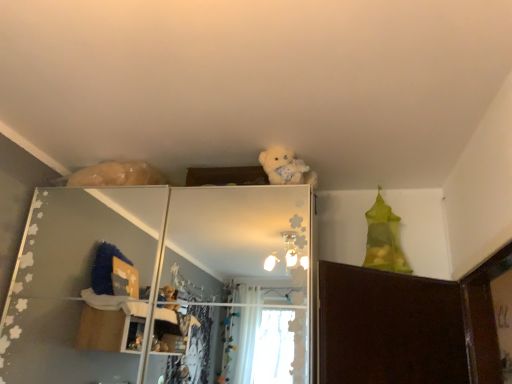
Locate an element on the screen. fluffy white teddy bear at upper center is located at coordinates click(286, 167).

Describe the element at coordinates (286, 167) in the screenshot. I see `fluffy white teddy bear at upper center` at that location.

In the scene shown: Measure the distance between white glossy shelf at upper center and camera.

6.44 feet.

What do you see at coordinates (162, 286) in the screenshot? The height and width of the screenshot is (384, 512). I see `white glossy shelf at upper center` at bounding box center [162, 286].

Find the location of a particular element. The width and height of the screenshot is (512, 384). white glossy shelf at upper center is located at coordinates (162, 286).

You are a GUI agent. You are given a task and a screenshot of the screen. Output one action in this format:
    pyautogui.click(x=<x>, y=<y>)
    Task: Click on the fluffy white teddy bear at upper center
    This screenshot has height=384, width=512.
    Given the screenshot: What is the action you would take?
    pyautogui.click(x=286, y=167)

Between white glossy shelf at upper center and fluffy white teddy bear at upper center, which one appears on the right side from the viewer's perspective?

fluffy white teddy bear at upper center.

Which object is further away from the camera taking this photo, white glossy shelf at upper center or fluffy white teddy bear at upper center?

fluffy white teddy bear at upper center.

Considering the points (219, 353) and (306, 171), which point is in front, point (219, 353) or point (306, 171)?

The point (219, 353) is closer.

From the image's perspective, is white glossy shelf at upper center on fluffy white teddy bear at upper center?

Actually, white glossy shelf at upper center appears below fluffy white teddy bear at upper center in the image.

From a real-world perspective, who is located lower, white glossy shelf at upper center or fluffy white teddy bear at upper center?

From a 3D spatial view, white glossy shelf at upper center is below.

Is white glossy shelf at upper center thinner than fluffy white teddy bear at upper center?

No, white glossy shelf at upper center is not thinner than fluffy white teddy bear at upper center.

Considering the sizes of objects white glossy shelf at upper center and fluffy white teddy bear at upper center in the image provided, who is shorter, white glossy shelf at upper center or fluffy white teddy bear at upper center?

fluffy white teddy bear at upper center is shorter.

Who is smaller, white glossy shelf at upper center or fluffy white teddy bear at upper center?

Smaller between the two is fluffy white teddy bear at upper center.

Which is correct: white glossy shelf at upper center is inside fluffy white teddy bear at upper center, or outside of it?

white glossy shelf at upper center is located beyond the bounds of fluffy white teddy bear at upper center.

Is white glossy shelf at upper center beside fluffy white teddy bear at upper center?

No, white glossy shelf at upper center is not beside fluffy white teddy bear at upper center.

Is white glossy shelf at upper center looking in the opposite direction of fluffy white teddy bear at upper center?

No, white glossy shelf at upper center is not facing the opposite direction of fluffy white teddy bear at upper center.

Locate an element on the screen. teddy lying behind the white glossy shelf at upper center is located at coordinates (286, 167).

Based on the photo, considering the relative positions of fluffy white teddy bear at upper center and white glossy shelf at upper center in the image provided, is fluffy white teddy bear at upper center to the left or to the right of white glossy shelf at upper center?

In the image, fluffy white teddy bear at upper center appears on the right side of white glossy shelf at upper center.

In the image, is fluffy white teddy bear at upper center positioned in front of or behind white glossy shelf at upper center?

fluffy white teddy bear at upper center is behind white glossy shelf at upper center.

Is point (292, 181) closer to camera compared to point (98, 194)?

That is True.

From the image's perspective, relative to white glossy shelf at upper center, is fluffy white teddy bear at upper center above or below?

Clearly, from the image's perspective, fluffy white teddy bear at upper center is above white glossy shelf at upper center.

From a real-world perspective, is fluffy white teddy bear at upper center located beneath white glossy shelf at upper center?

Incorrect, from a real-world perspective, fluffy white teddy bear at upper center is higher than white glossy shelf at upper center.

Does fluffy white teddy bear at upper center have a lesser width compared to white glossy shelf at upper center?

Correct, the width of fluffy white teddy bear at upper center is less than that of white glossy shelf at upper center.

Which of these two, fluffy white teddy bear at upper center or white glossy shelf at upper center, stands taller?

white glossy shelf at upper center.

Is fluffy white teddy bear at upper center smaller than white glossy shelf at upper center?

Yes, fluffy white teddy bear at upper center is smaller than white glossy shelf at upper center.

Can we say fluffy white teddy bear at upper center lies outside white glossy shelf at upper center?

Absolutely, fluffy white teddy bear at upper center is external to white glossy shelf at upper center.

Is there a large distance between fluffy white teddy bear at upper center and white glossy shelf at upper center?

fluffy white teddy bear at upper center is positioned a significant distance from white glossy shelf at upper center.

Is fluffy white teddy bear at upper center looking in the opposite direction of white glossy shelf at upper center?

No.

Locate an element on the screen. Image resolution: width=512 pixels, height=384 pixels. shelf on the left side of fluffy white teddy bear at upper center is located at coordinates (162, 286).

This screenshot has width=512, height=384. Find the location of `shelf in front of the fluffy white teddy bear at upper center`. shelf in front of the fluffy white teddy bear at upper center is located at coordinates (162, 286).

Identify the location of teddy lying behind the white glossy shelf at upper center. (286, 167).